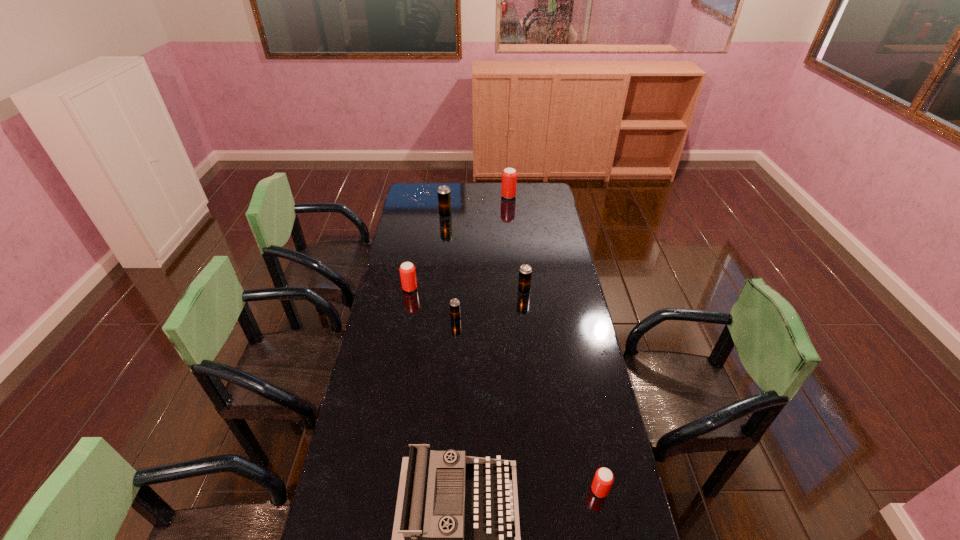
Where is `object present at the right edge`? object present at the right edge is located at coordinates (603, 479).

The width and height of the screenshot is (960, 540). Identify the location of free region at the far edge of the desktop. (464, 193).

You are a GUI agent. You are given a task and a screenshot of the screen. Output one action in this format:
    pyautogui.click(x=<x>, y=<y>)
    Task: Click on the free location at the left edge of the desktop
    The height and width of the screenshot is (540, 960).
    Given the screenshot: What is the action you would take?
    coord(356,474)

In the image, there is a desktop. At what (x,y) coordinates should I click in order to perform the action: click on vacant region at the right edge. Please return your answer as a coordinate pair (x, y). Looking at the image, I should click on (564, 241).

The image size is (960, 540). Find the location of `vacant space at the far left corner`. vacant space at the far left corner is located at coordinates (408, 195).

Where is `free space between the second nearest red beer can and the leftmost black beer can`? Image resolution: width=960 pixels, height=540 pixels. free space between the second nearest red beer can and the leftmost black beer can is located at coordinates (427, 252).

The width and height of the screenshot is (960, 540). In order to click on free space between the second smallest red beer can and the farthest object in this screenshot , I will do `click(459, 242)`.

Find the location of a particular element. free point between the second smallest black beer can and the sixth nearest object is located at coordinates (485, 253).

Locate an element on the screen. This screenshot has width=960, height=540. free space that is in between the second farthest red beer can and the nearest red beer can is located at coordinates (505, 389).

This screenshot has width=960, height=540. Identify the location of blank region between the leftmost red beer can and the fourth beer can from right to left. (433, 303).